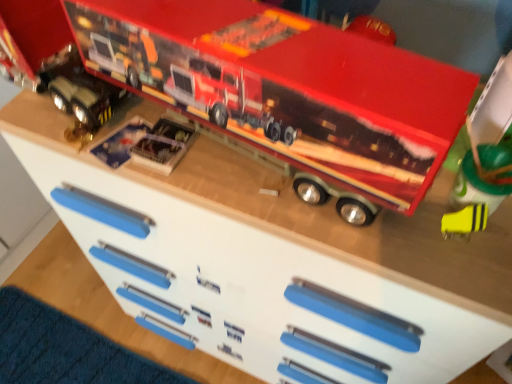
Question: Does yellow matte eraser at lower right, placed as the first toy when sorted from right to left, appear on the right side of metallic silver toy truck at center, positioned as the fourth toy in right-to-left order?

Choices:
 (A) yes
 (B) no

Answer: (A)

Question: Is yellow matte eraser at lower right, which is the fourth toy from left to right, facing away from metallic silver toy truck at center, arranged as the 1th toy when viewed from the left?

Choices:
 (A) yes
 (B) no

Answer: (B)

Question: Can you confirm if yellow matte eraser at lower right, which is the fourth toy from left to right, is taller than metallic silver toy truck at center, positioned as the fourth toy in right-to-left order?

Choices:
 (A) no
 (B) yes

Answer: (B)

Question: Are yellow matte eraser at lower right, placed as the first toy when sorted from right to left, and metallic silver toy truck at center, arranged as the 1th toy when viewed from the left, beside each other?

Choices:
 (A) no
 (B) yes

Answer: (A)

Question: Considering the relative sizes of yellow matte eraser at lower right, placed as the first toy when sorted from right to left, and metallic silver toy truck at center, positioned as the fourth toy in right-to-left order, in the image provided, is yellow matte eraser at lower right, placed as the first toy when sorted from right to left, wider than metallic silver toy truck at center, positioned as the fourth toy in right-to-left order,?

Choices:
 (A) no
 (B) yes

Answer: (A)

Question: Is yellow matte eraser at lower right, which is the fourth toy from left to right, further to the viewer compared to metallic silver toy truck at center, positioned as the fourth toy in right-to-left order?

Choices:
 (A) no
 (B) yes

Answer: (A)

Question: Is metallic red truck at upper center, placed as the 3th toy when sorted from left to right, positioned beyond the bounds of metallic silver toy truck at center, positioned as the fourth toy in right-to-left order?

Choices:
 (A) no
 (B) yes

Answer: (B)

Question: Can you confirm if metallic red truck at upper center, which ranks as the 2th toy in right-to-left order, is taller than metallic silver toy truck at center, positioned as the fourth toy in right-to-left order?

Choices:
 (A) yes
 (B) no

Answer: (A)

Question: Is metallic red truck at upper center, which ranks as the 2th toy in right-to-left order, directly adjacent to metallic silver toy truck at center, arranged as the 1th toy when viewed from the left?

Choices:
 (A) no
 (B) yes

Answer: (A)

Question: Does metallic red truck at upper center, placed as the 3th toy when sorted from left to right, come in front of metallic silver toy truck at center, arranged as the 1th toy when viewed from the left?

Choices:
 (A) no
 (B) yes

Answer: (B)

Question: Is metallic silver toy truck at center, arranged as the 1th toy when viewed from the left, located within metallic red truck at upper center, which ranks as the 2th toy in right-to-left order?

Choices:
 (A) no
 (B) yes

Answer: (B)

Question: Does metallic red truck at upper center, which ranks as the 2th toy in right-to-left order, have a larger size compared to metallic silver toy truck at center, arranged as the 1th toy when viewed from the left?

Choices:
 (A) no
 (B) yes

Answer: (B)

Question: Does metallic silver toy truck at center, arranged as the 1th toy when viewed from the left, have a greater width compared to yellow matte eraser at lower right, which is the fourth toy from left to right?

Choices:
 (A) no
 (B) yes

Answer: (B)